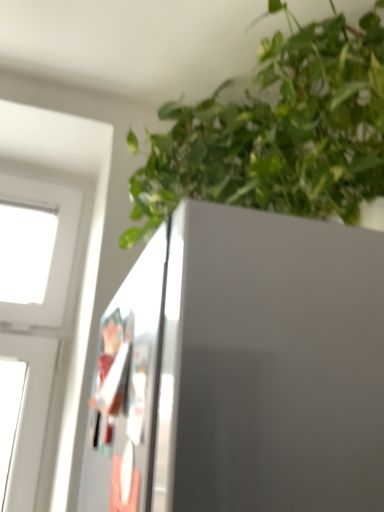
Question: Considering the relative sizes of transparent plastic screen door at left and green leafy plant at upper right in the image provided, is transparent plastic screen door at left smaller than green leafy plant at upper right?

Choices:
 (A) yes
 (B) no

Answer: (A)

Question: Is transparent plastic screen door at left shorter than green leafy plant at upper right?

Choices:
 (A) no
 (B) yes

Answer: (B)

Question: Does transparent plastic screen door at left turn towards green leafy plant at upper right?

Choices:
 (A) yes
 (B) no

Answer: (B)

Question: Does transparent plastic screen door at left appear on the right side of green leafy plant at upper right?

Choices:
 (A) no
 (B) yes

Answer: (A)

Question: Is the depth of transparent plastic screen door at left less than that of green leafy plant at upper right?

Choices:
 (A) no
 (B) yes

Answer: (B)

Question: From the image's perspective, would you say transparent plastic screen door at left is shown under green leafy plant at upper right?

Choices:
 (A) no
 (B) yes

Answer: (B)

Question: Considering the relative sizes of green leafy plant at upper right and transparent plastic screen door at left in the image provided, is green leafy plant at upper right shorter than transparent plastic screen door at left?

Choices:
 (A) no
 (B) yes

Answer: (A)

Question: Is green leafy plant at upper right far away from transparent plastic screen door at left?

Choices:
 (A) yes
 (B) no

Answer: (B)

Question: Considering the relative positions of green leafy plant at upper right and transparent plastic screen door at left in the image provided, is green leafy plant at upper right in front of transparent plastic screen door at left?

Choices:
 (A) no
 (B) yes

Answer: (A)

Question: From the image's perspective, is green leafy plant at upper right located beneath transparent plastic screen door at left?

Choices:
 (A) yes
 (B) no

Answer: (B)

Question: Can you confirm if green leafy plant at upper right is bigger than transparent plastic screen door at left?

Choices:
 (A) yes
 (B) no

Answer: (A)

Question: Could you tell me if green leafy plant at upper right is turned towards transparent plastic screen door at left?

Choices:
 (A) no
 (B) yes

Answer: (A)

Question: Considering the positions of point (278, 54) and point (122, 293), is point (278, 54) closer or farther from the camera than point (122, 293)?

Choices:
 (A) farther
 (B) closer

Answer: (A)